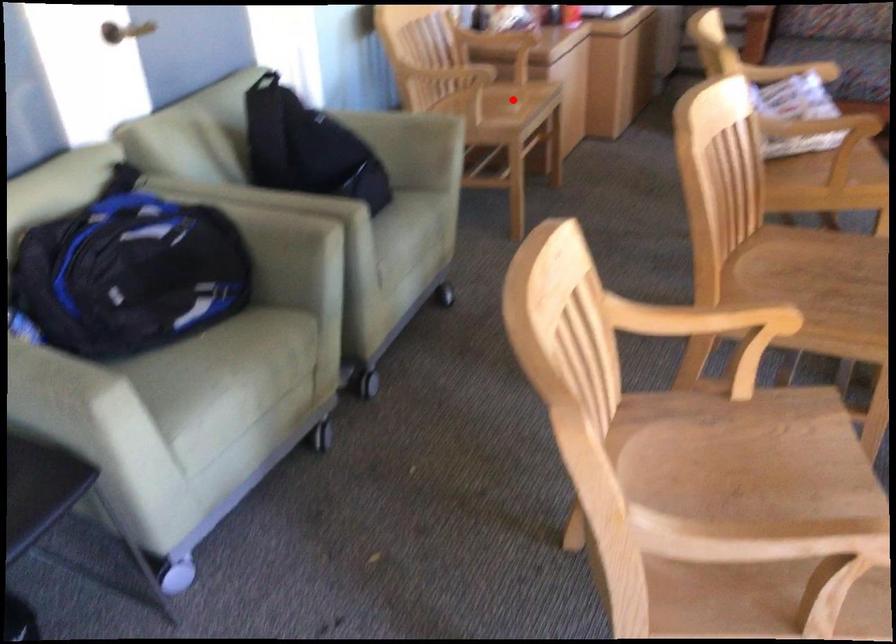
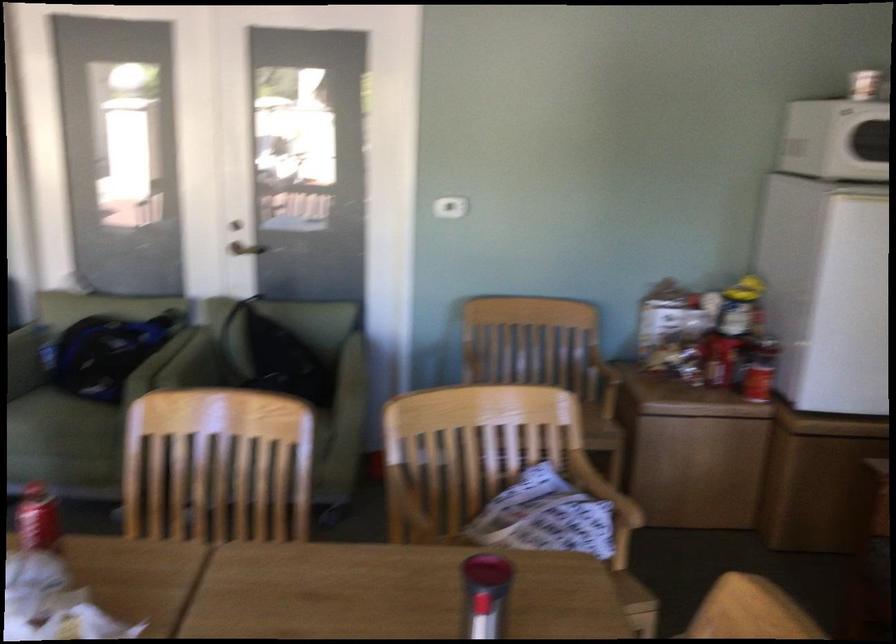
Question: I am providing you with two images of the same scene from different viewpoints. A red point is marked on the first image. At the location where the point appears in image 1, is it still visible in image 2?

Choices:
 (A) Yes
 (B) No

Answer: (B)